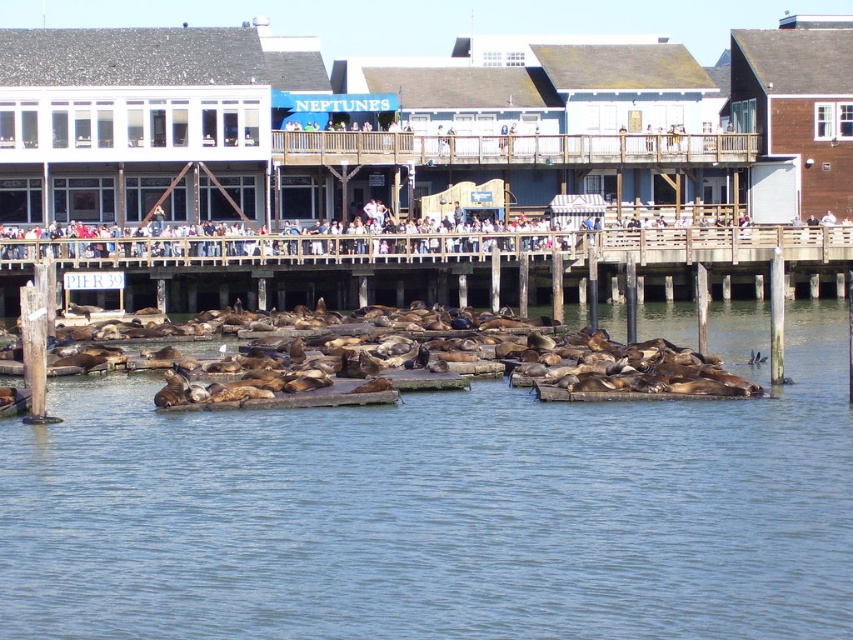
Who is shorter, clear blue water at center or brown fur seal at lower center?

brown fur seal at lower center

Can you confirm if clear blue water at center is positioned to the left of brown fur seal at lower center?

In fact, clear blue water at center is to the right of brown fur seal at lower center.

What do you see at coordinates (437, 513) in the screenshot? I see `clear blue water at center` at bounding box center [437, 513].

This screenshot has width=853, height=640. Identify the location of clear blue water at center. (437, 513).

Does light brown wooden pier at center appear over brown fur seal at lower center?

Yes, light brown wooden pier at center is above brown fur seal at lower center.

Which is behind, point (447, 257) or point (293, 378)?

Point (447, 257)

Identify the location of light brown wooden pier at center. (447, 244).

Who is taller, brown wooden dock at center or light brown wooden pier at center?

Standing taller between the two is brown wooden dock at center.

Based on the photo, measure the distance between brown wooden dock at center and camera.

A distance of 98.20 meters exists between brown wooden dock at center and camera.

You are a GUI agent. You are given a task and a screenshot of the screen. Output one action in this format:
    pyautogui.click(x=<x>, y=<y>)
    Task: Click on the brown wooden dock at center
    
    Given the screenshot: What is the action you would take?
    pyautogui.click(x=433, y=250)